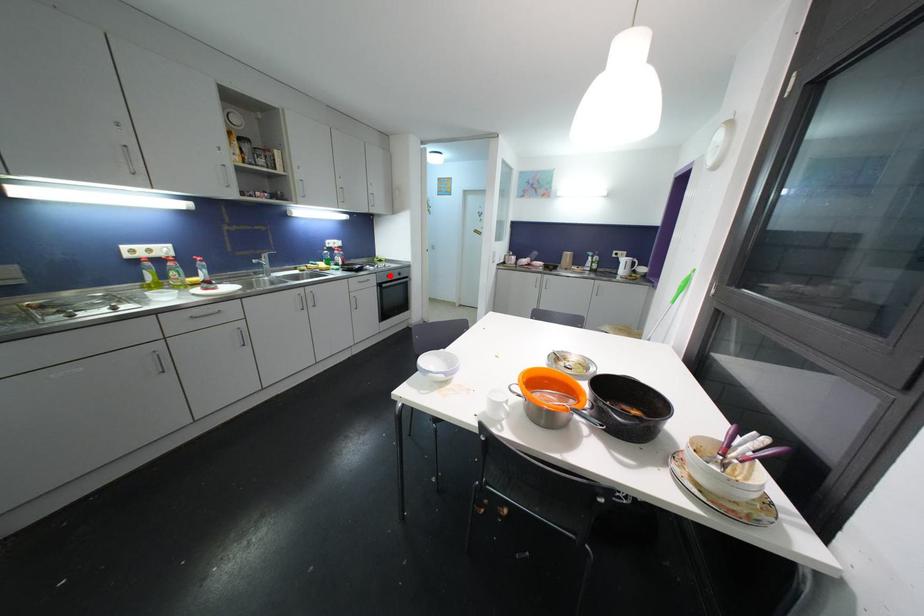
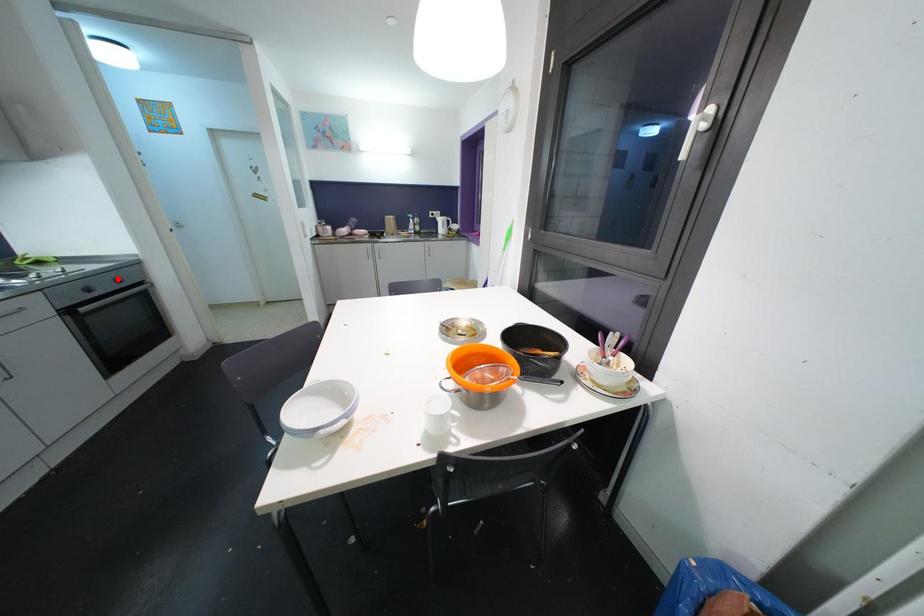
I am providing you with two images of the same scene from different viewpoints. A red point is marked on the first image and another point is marked on the second image. Do the highlighted points in image1 and image2 indicate the same real-world spot?

No